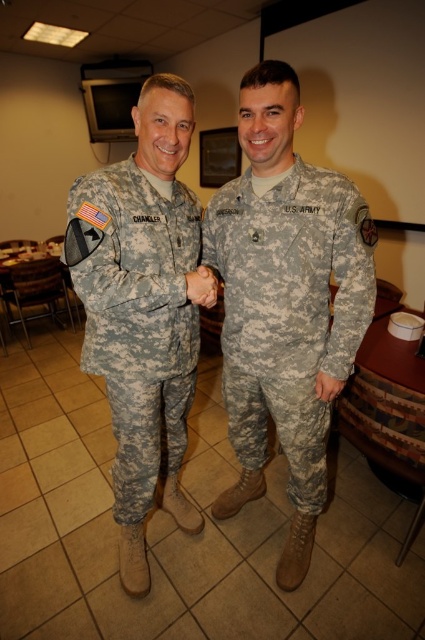
You are a photographer positioned in front of the dining area. You need to take a photo of both the camouflage uniform at center and the camouflage fabric uniform at left. Which one should you focus on first to ensure it appears clearer in the photo?

The camouflage uniform at center is closer to you than the camouflage fabric uniform at left, so focusing on the camouflage uniform at center first will ensure it appears clearer in the photo.

You are standing in the dining area and want to move from point A to point B. Point A is at coordinates point (309, 388) and point B is at coordinates point (136, 435). According to the scene, which direction should you move to get from point A to point B?

To move from point A at coordinates point (309, 388) to point B at coordinates point (136, 435), you should move downward since point A is in front of point B, indicating that point B is behind point A in the scene.